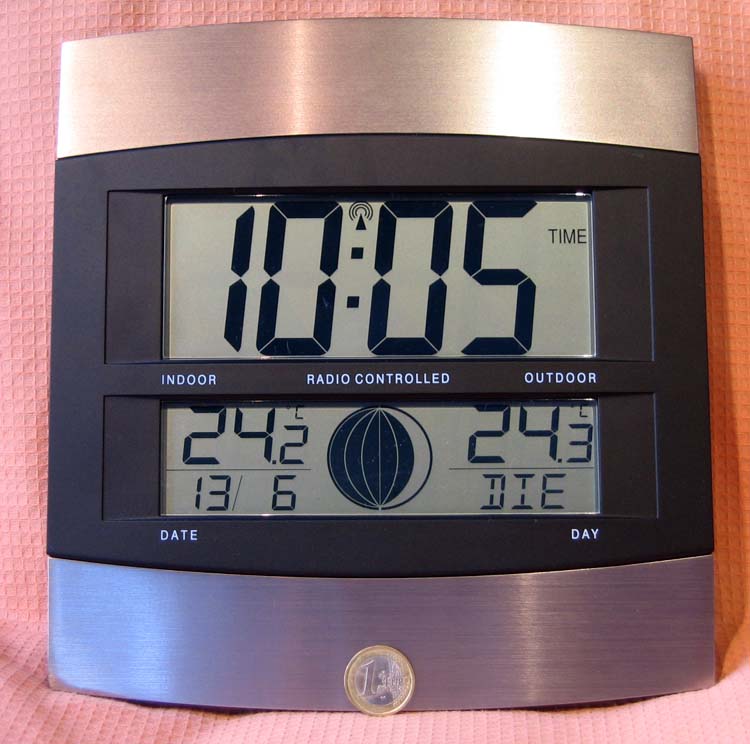
Where is `chair`? This screenshot has width=750, height=744. chair is located at coordinates (64, 716).